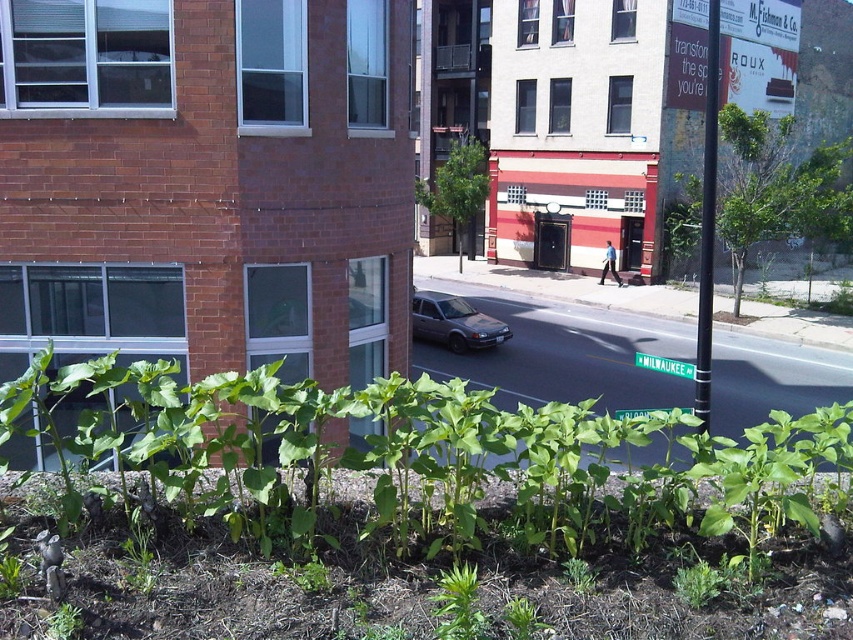
Question: Among these objects, which one is nearest to the camera?

Choices:
 (A) green plastic street sign at lower center
 (B) satin silver sedan at center

Answer: (A)

Question: Is satin silver sedan at center to the left of green plastic street sign at lower center from the viewer's perspective?

Choices:
 (A) yes
 (B) no

Answer: (A)

Question: Observing the image, what is the correct spatial positioning of satin silver sedan at center in reference to green plastic street sign at lower center?

Choices:
 (A) below
 (B) above

Answer: (B)

Question: Can you confirm if satin silver sedan at center is positioned below green plastic street sign at lower center?

Choices:
 (A) yes
 (B) no

Answer: (B)